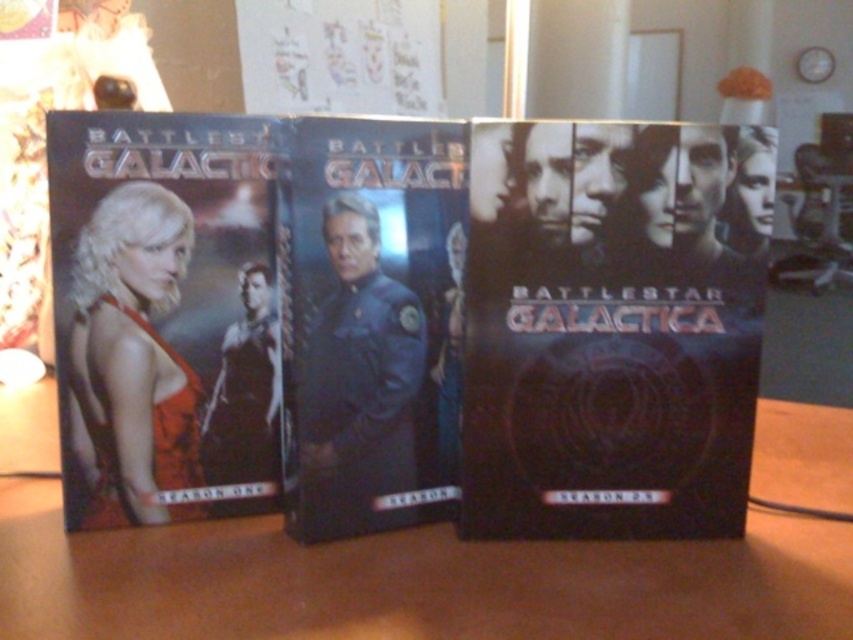
Question: Which point appears farthest from the camera in this image?

Choices:
 (A) (161, 352)
 (B) (433, 624)
 (C) (526, 420)

Answer: (A)

Question: Is wooden table at center to the left of matte orange dress at left from the viewer's perspective?

Choices:
 (A) no
 (B) yes

Answer: (A)

Question: Considering the relative positions of black matte dvd at center and wooden table at center in the image provided, where is black matte dvd at center located with respect to wooden table at center?

Choices:
 (A) below
 (B) above

Answer: (B)

Question: Which object appears farthest from the camera in this image?

Choices:
 (A) black matte dvd at center
 (B) wooden table at center
 (C) shiny blue uniform at center

Answer: (A)

Question: From the image, what is the correct spatial relationship of wooden table at center in relation to shiny blue uniform at center?

Choices:
 (A) above
 (B) below

Answer: (B)

Question: Which point appears farthest from the camera in this image?

Choices:
 (A) (430, 396)
 (B) (715, 346)

Answer: (A)